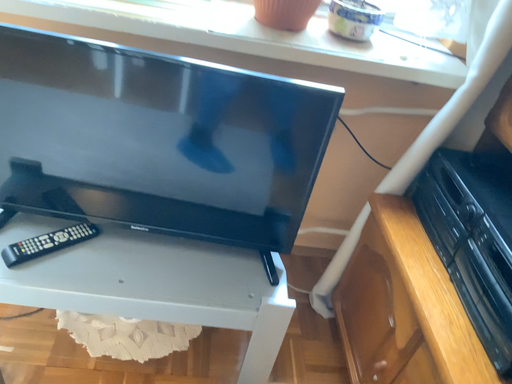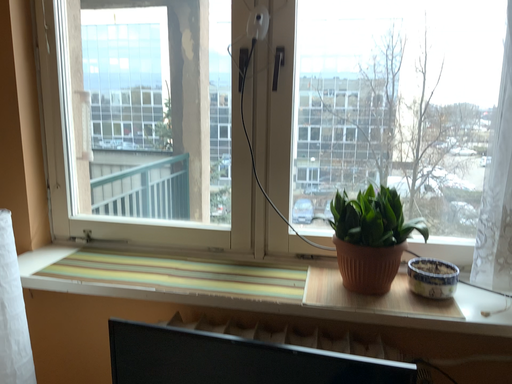
Question: Which way did the camera rotate in the video?

Choices:
 (A) rotated downward
 (B) rotated upward

Answer: (B)